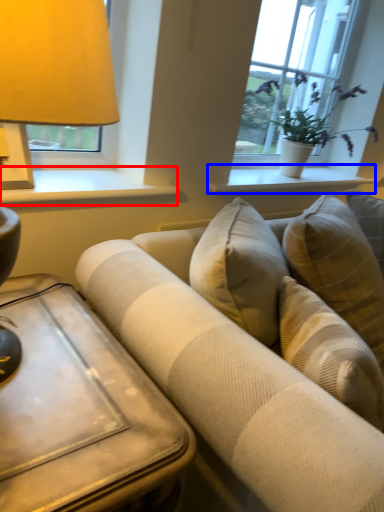
Question: Which object is closer to the camera taking this photo, window sill (highlighted by a red box) or window sill (highlighted by a blue box)?

Choices:
 (A) window sill
 (B) window sill

Answer: (A)